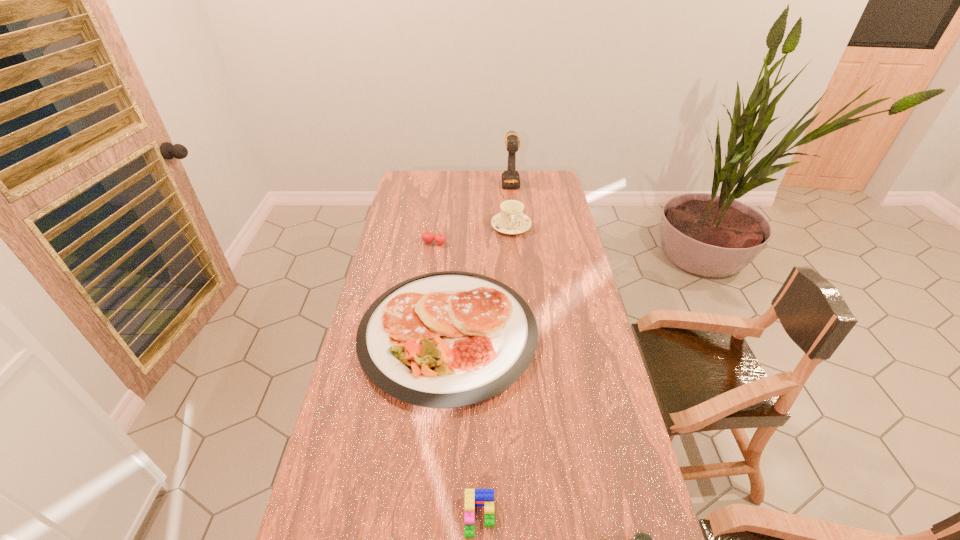
You are a GUI agent. You are given a task and a screenshot of the screen. Output one action in this format:
    pyautogui.click(x=<x>, y=<y>)
    Task: Click on the drill
    The image size is (960, 540).
    Given the screenshot: What is the action you would take?
    pyautogui.click(x=510, y=177)

Locate an element on the screen. This screenshot has height=540, width=960. the tallest object is located at coordinates [x=510, y=177].

Locate an element on the screen. the second farthest object is located at coordinates (511, 220).

This screenshot has width=960, height=540. What are the coordinates of `the fifth shortest object` in the screenshot? It's located at (511, 220).

Where is `the third farthest object`? The height and width of the screenshot is (540, 960). the third farthest object is located at coordinates (428, 237).

The image size is (960, 540). Identify the location of the third nearest object. (449, 339).

Where is `Lego`? Lego is located at coordinates (473, 497).

Locate an element on the screen. This screenshot has height=540, width=960. vacant region located 0.050m on the handle side of the chinaware is located at coordinates (513, 245).

This screenshot has width=960, height=540. I want to click on vacant region located 0.310m on the right of the cherry, so coord(520,243).

Find the location of a particular element. free space located 0.350m on the back of the third nearest object is located at coordinates (456, 225).